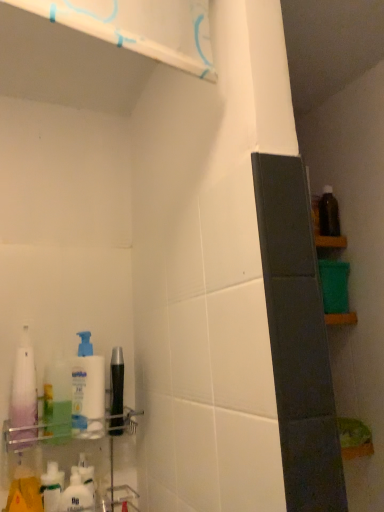
Question: Is white glossy lotion at lower left wider or thinner than white glossy pump bottle at left, arranged as the 2th cleaning product when viewed from the right?

Choices:
 (A) thin
 (B) wide

Answer: (A)

Question: Would you say white glossy lotion at lower left is to the left or to the right of white glossy pump bottle at left, arranged as the 2th cleaning product when viewed from the right, in the picture?

Choices:
 (A) left
 (B) right

Answer: (A)

Question: Considering the real-world distances, which object is closest to the white glossy pump bottle at left, which is the second cleaning product in left-to-right order?

Choices:
 (A) white glossy lotion at lower left
 (B) translucent purple bottle at left, marked as the 3th cleaning product in a right-to-left arrangement
 (C) white glossy shelf at upper left, the first shelf from the top
 (D) white matte pump bottle at left, the first cleaning product positioned from the right
 (E) clear plastic shelf at lower left, arranged as the 1th shelf when ordered from the bottom

Answer: (D)

Question: Based on their relative distances, which object is nearer to the translucent purple bottle at left, marked as the 3th cleaning product in a right-to-left arrangement?

Choices:
 (A) clear plastic shelf at lower left, the 1th shelf positioned from the back
 (B) white glossy lotion at lower left
 (C) white glossy shelf at upper left, the 2th shelf ordered from the bottom
 (D) white matte pump bottle at left, the first cleaning product positioned from the right
 (E) white glossy pump bottle at left, which is the second cleaning product in left-to-right order

Answer: (E)